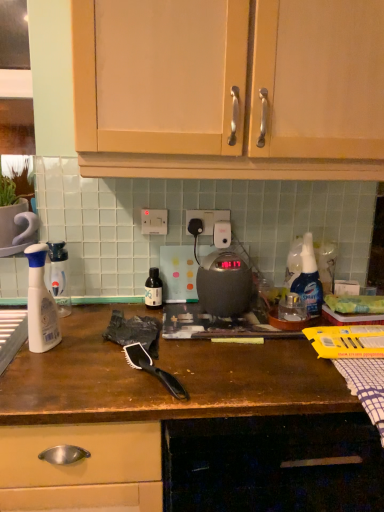
This screenshot has width=384, height=512. I want to click on vacant area that is situated to the right of white plastic spray bottle at left, marked as the first bottle in a left-to-right arrangement, so click(x=97, y=314).